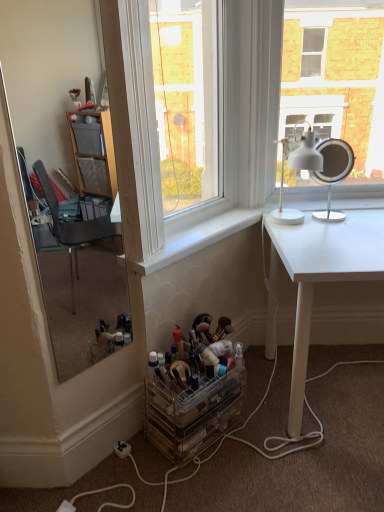
Question: Do you think white smooth window sill at center is within clear glass window at center, or outside of it?

Choices:
 (A) inside
 (B) outside

Answer: (B)

Question: Considering the positions of white smooth window sill at center and clear glass window at center in the image, is white smooth window sill at center wider or thinner than clear glass window at center?

Choices:
 (A) thin
 (B) wide

Answer: (A)

Question: Which object is the closest to the clear plastic makeup organizer at lower left?

Choices:
 (A) clear acrylic makeup organizer at lower center
 (B) clear glass window at center
 (C) white smooth window sill at center
 (D) white matte desk at right
 (E) clear glass mirror at left

Answer: (A)

Question: Based on their relative distances, which object is farther from the white matte table lamp at upper right, the second table lamp positioned from the right?

Choices:
 (A) white smooth window sill at center
 (B) clear glass mirror at left
 (C) clear plastic makeup organizer at lower left
 (D) white plastic table lamp at upper right, which is counted as the second table lamp, starting from the left
 (E) clear glass window at center

Answer: (B)